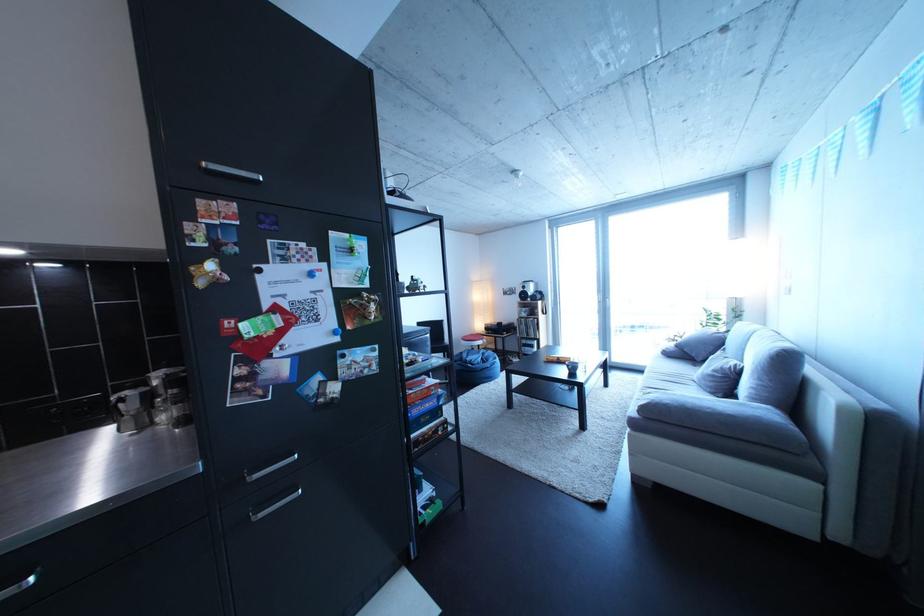
The location [420,389] corresponds to which object?

This point indicates the blue board game box.